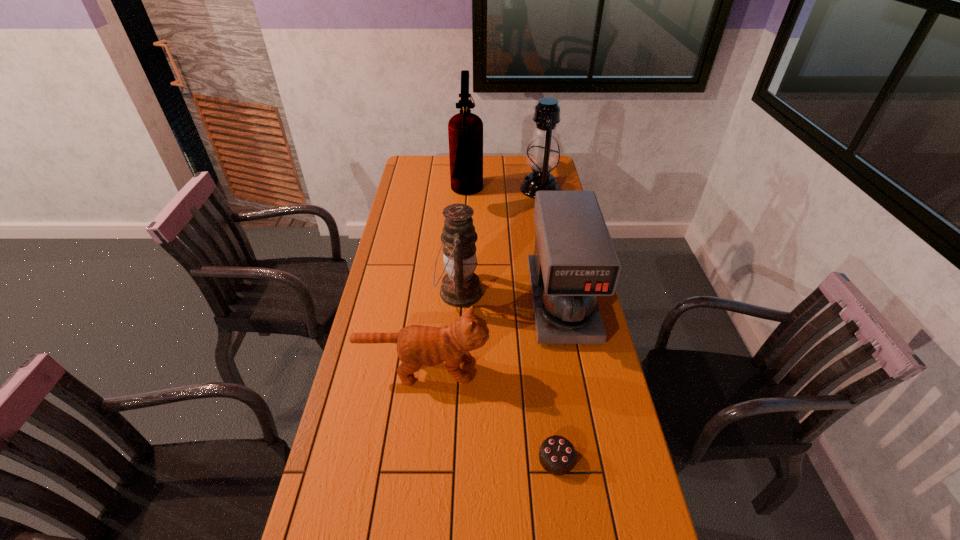
Identify the location of free space located 0.090m on the left of the right lantern. The image size is (960, 540). point(501,190).

What are the coordinates of `free region located on the front of the left lantern` in the screenshot? It's located at (457, 334).

At what (x,y) coordinates should I click in order to perform the action: click on vacant space located on the carafe side of the coffee maker. Please return your answer as a coordinate pair (x, y). This screenshot has height=540, width=960. Looking at the image, I should click on (575, 373).

Locate an element on the screen. This screenshot has height=540, width=960. free spot located on the face of the cat is located at coordinates [528, 369].

Locate an element on the screen. The width and height of the screenshot is (960, 540). vacant space located on the left of the shortest object is located at coordinates (475, 458).

Locate an element on the screen. fire extinguisher that is at the far edge is located at coordinates (465, 130).

This screenshot has height=540, width=960. I want to click on oil lamp present at the far edge, so click(543, 156).

This screenshot has width=960, height=540. What are the coordinates of `object that is at the left edge` in the screenshot? It's located at (417, 345).

Locate an element on the screen. The height and width of the screenshot is (540, 960). oil lamp that is at the right edge is located at coordinates (543, 156).

At what (x,y) coordinates should I click in order to perform the action: click on coffee maker that is at the right edge. Please return your answer as a coordinate pair (x, y). Looking at the image, I should click on (574, 261).